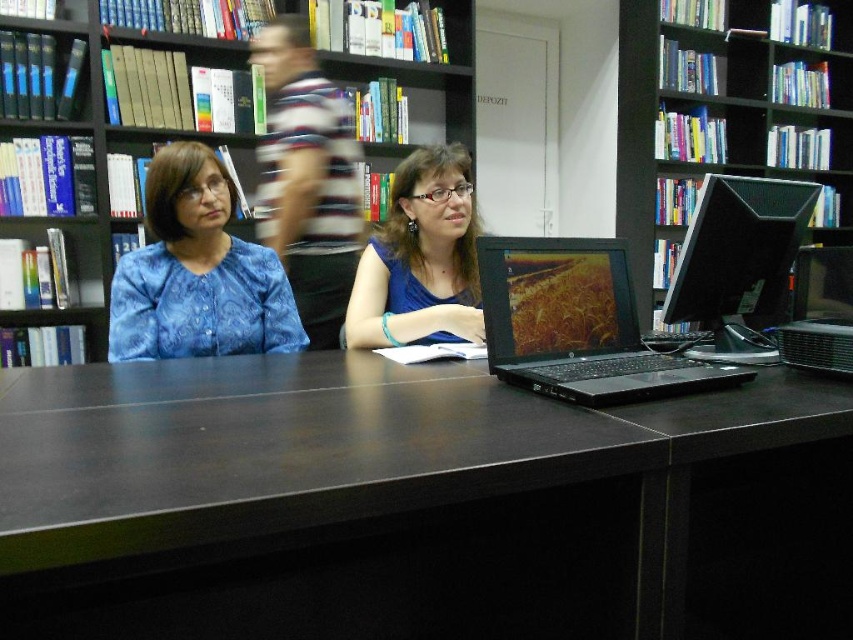
Question: From the image, what is the correct spatial relationship of dark wood table at center in relation to blue patterned blouse at center?

Choices:
 (A) above
 (B) below

Answer: (B)

Question: Which object is the closest to the blue fabric shirt at center?

Choices:
 (A) black matte bookcase at upper center
 (B) blue patterned blouse at center

Answer: (B)

Question: Can you confirm if blue fabric shirt at center is smaller than black glossy monitor at right?

Choices:
 (A) no
 (B) yes

Answer: (A)

Question: Estimate the real-world distances between objects in this image. Which object is farther from the black matte laptop at center?

Choices:
 (A) blue patterned blouse at center
 (B) black glossy monitor at right
 (C) blue fabric shirt at center
 (D) black matte bookcase at upper center

Answer: (D)

Question: Which object is farther from the camera taking this photo?

Choices:
 (A) blue patterned blouse at center
 (B) striped fabric shirt at upper center

Answer: (B)

Question: Can you confirm if wooden bookshelf at center is positioned below striped fabric shirt at upper center?

Choices:
 (A) yes
 (B) no

Answer: (B)